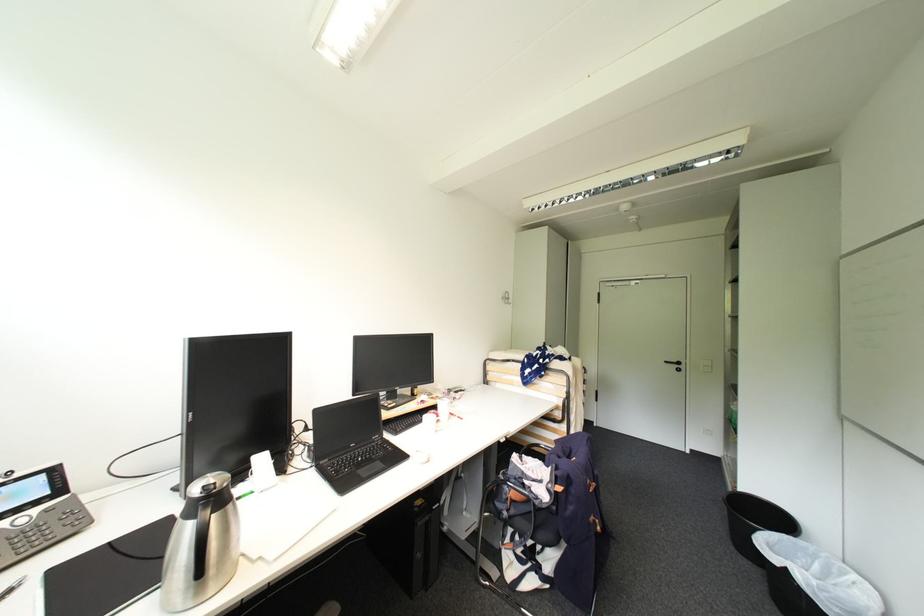
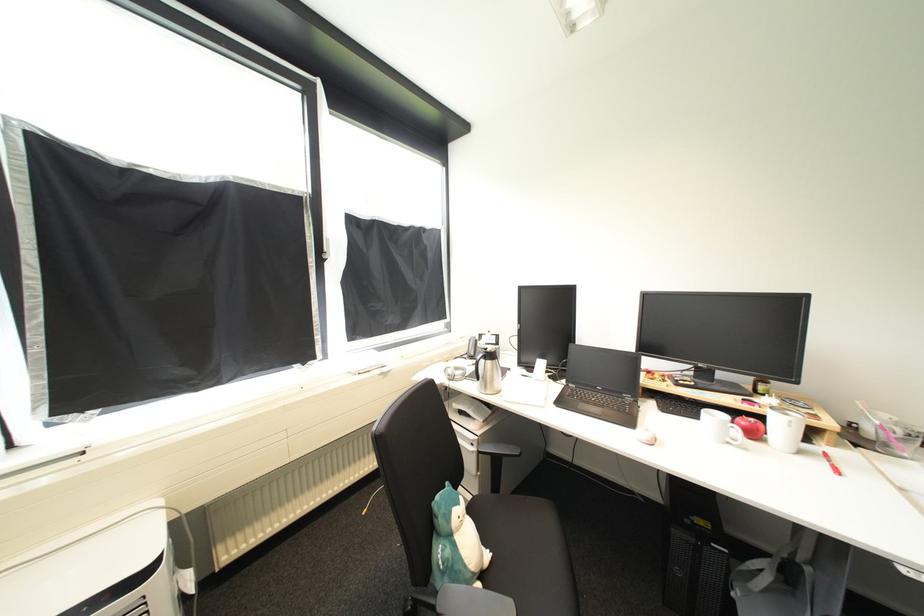
The point at (463, 418) is marked in the first image. Where is the corresponding point in the second image?

(834, 464)